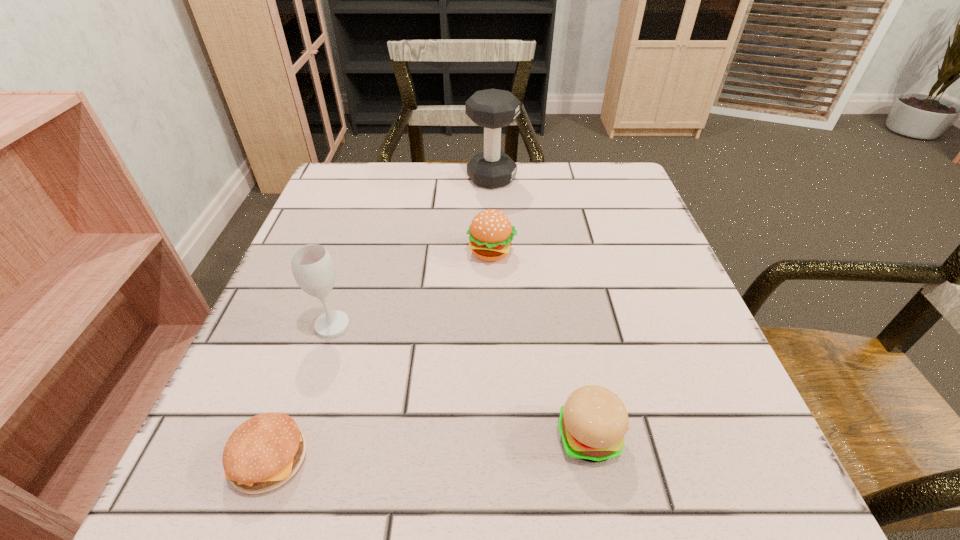
Where is `free space at the left edge of the desktop`? Image resolution: width=960 pixels, height=540 pixels. free space at the left edge of the desktop is located at coordinates (360, 305).

Where is `vacant region at the right edge of the desktop`? vacant region at the right edge of the desktop is located at coordinates (729, 423).

Where is `vacant space at the far left corner`? Image resolution: width=960 pixels, height=540 pixels. vacant space at the far left corner is located at coordinates (384, 162).

Find the location of a particular element. vacant space at the far right corner is located at coordinates (641, 213).

Locate an element on the screen. vacant area that lies between the fourth nearest object and the third farthest object is located at coordinates (412, 288).

Find the location of a particular element. This screenshot has height=540, width=960. free spot between the rightmost hamburger and the third tallest object is located at coordinates (540, 344).

At what (x,y) coordinates should I click in order to perform the action: click on free space between the second tallest object and the farthest hamburger. Please return your answer as a coordinate pair (x, y). This screenshot has height=540, width=960. Looking at the image, I should click on (412, 288).

Identify the location of vacant area between the dumbbell and the second shortest object. This screenshot has width=960, height=540. (540, 307).

Find the location of a particular element. This screenshot has width=960, height=540. free spot between the second hamburger from left to right and the shortest object is located at coordinates (381, 355).

The width and height of the screenshot is (960, 540). In order to click on blank region between the second tallest hamburger and the farthest hamburger in this screenshot , I will do `click(540, 344)`.